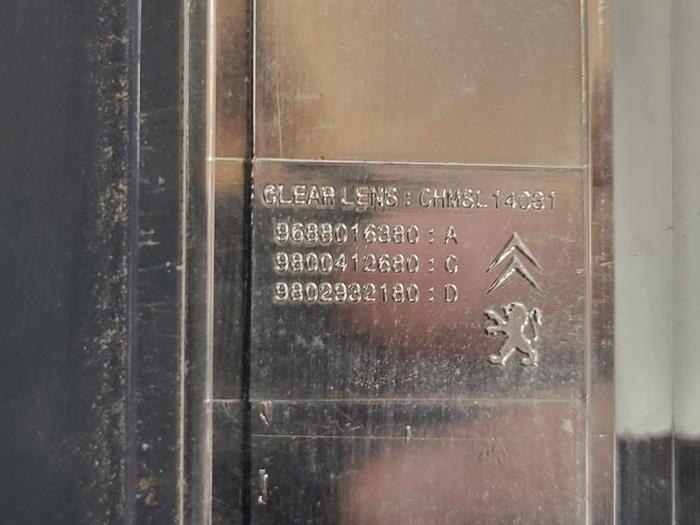
This screenshot has height=525, width=700. Identify the location of wall. (87, 266).